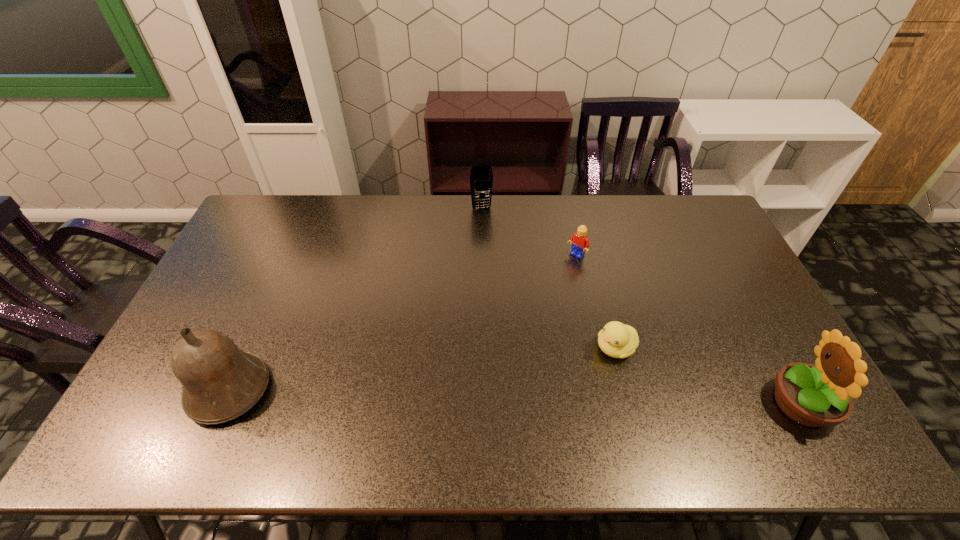
You are a GUI agent. You are given a task and a screenshot of the screen. Output one action in this format:
    pyautogui.click(x=<x>, y=<y>)
    Task: Click on the bell positioned at the near edge
    The height and width of the screenshot is (540, 960).
    Given the screenshot: What is the action you would take?
    pyautogui.click(x=220, y=382)

In order to click on sunflower that is positioned at the near edge in this screenshot , I will do `click(817, 395)`.

Image resolution: width=960 pixels, height=540 pixels. Identify the location of object present at the left edge. pyautogui.click(x=220, y=382).

Image resolution: width=960 pixels, height=540 pixels. In order to click on object at the right edge in this screenshot , I will do `click(817, 395)`.

Image resolution: width=960 pixels, height=540 pixels. In order to click on object positioned at the near left corner in this screenshot , I will do `click(220, 382)`.

What are the coordinates of `object that is at the near right corner` in the screenshot? It's located at (817, 395).

At what (x,y) coordinates should I click in order to perform the action: click on vacant area at the far edge. Please return your answer as a coordinate pair (x, y). The width and height of the screenshot is (960, 540). Looking at the image, I should click on (394, 197).

Where is `vacant space at the near edge`? The image size is (960, 540). vacant space at the near edge is located at coordinates (293, 395).

Find the location of `blank space at the left edge`. blank space at the left edge is located at coordinates (221, 320).

The height and width of the screenshot is (540, 960). I want to click on free space at the right edge, so click(723, 328).